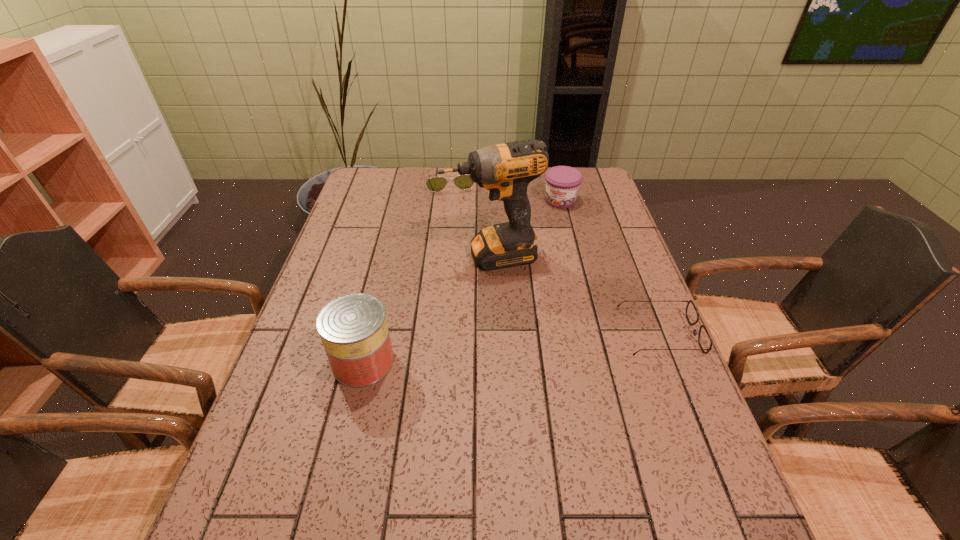
At what (x,y) coordinates should I click in order to perform the action: click on free space on the desktop that is between the fourth shortest object and the right sunglasses and is positioned on the front label of the jam. Please return your answer as a coordinate pair (x, y). Image resolution: width=960 pixels, height=540 pixels. Looking at the image, I should click on (494, 349).

At what (x,y) coordinates should I click in order to perform the action: click on free space on the desktop that is between the can and the rightmost object and is positioned with the drill bit of the drill facing forward. Please return your answer as a coordinate pair (x, y). The height and width of the screenshot is (540, 960). Looking at the image, I should click on (532, 346).

This screenshot has width=960, height=540. I want to click on free spot on the desktop that is between the can and the rightmost object and is positioned on the front-facing side of the farther sunglasses, so click(x=482, y=350).